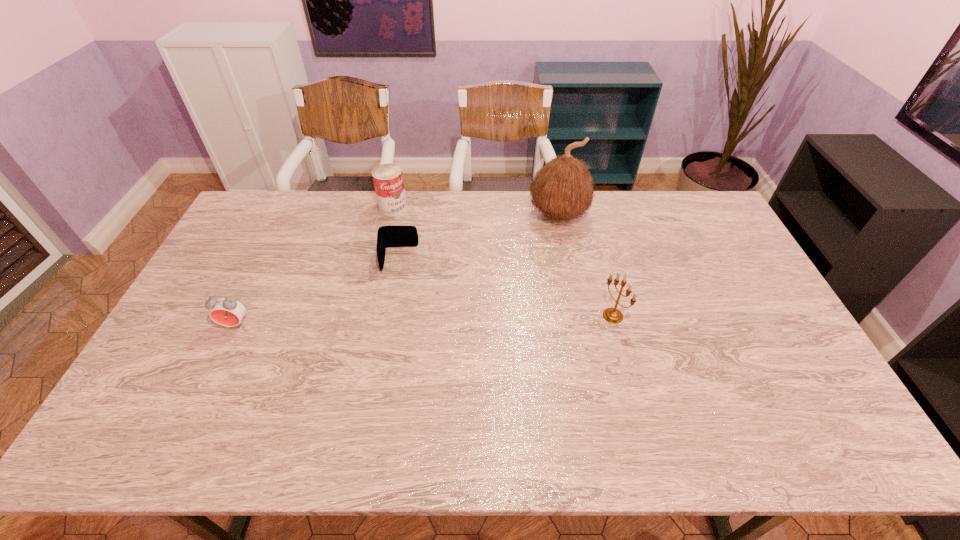
The width and height of the screenshot is (960, 540). I want to click on vacant spot on the desktop that is between the leftmost object and the candelabrum and is positioned on the surface of the tallest object, so click(x=470, y=319).

Identify the location of free space on the desktop that is between the leftmost object and the candelabrum and is positioned on the outer surface of the shortest object. The width and height of the screenshot is (960, 540). (395, 321).

You are a GUI agent. You are given a task and a screenshot of the screen. Output one action in this format:
    pyautogui.click(x=<x>, y=<y>)
    Task: Click on the vacant space on the desktop that is between the alarm clock and the candelabrum and is positioned on the front label of the can
    The width and height of the screenshot is (960, 540).
    Given the screenshot: What is the action you would take?
    pyautogui.click(x=478, y=319)